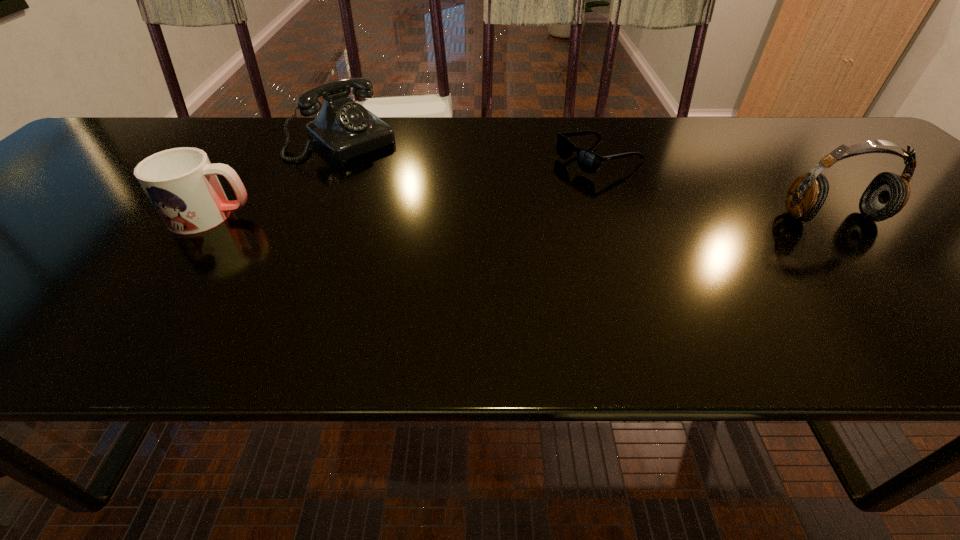
Where is `vacant space that's between the mug and the sunglasses`? Image resolution: width=960 pixels, height=540 pixels. vacant space that's between the mug and the sunglasses is located at coordinates (405, 187).

The image size is (960, 540). In order to click on free area in between the mug and the telephone in this screenshot , I will do `click(277, 178)`.

The height and width of the screenshot is (540, 960). Identify the location of vacant region between the tallest object and the mug. (521, 217).

The image size is (960, 540). Find the location of `vacant point located between the telephone and the sunglasses`. vacant point located between the telephone and the sunglasses is located at coordinates (471, 148).

Find the location of a particular element. The height and width of the screenshot is (540, 960). free space between the rightmost object and the telephone is located at coordinates (588, 178).

The width and height of the screenshot is (960, 540). I want to click on vacant area between the rightmost object and the sunglasses, so click(715, 187).

This screenshot has height=540, width=960. Find the location of `free spot between the mug and the second object from right to left`. free spot between the mug and the second object from right to left is located at coordinates (405, 187).

Find the location of a particular element. The width and height of the screenshot is (960, 540). free area in between the headset and the shortest object is located at coordinates (715, 187).

Where is `free space between the telephone and the mug`? free space between the telephone and the mug is located at coordinates (277, 178).

Identify the location of free space that is in between the shortest object and the headset. (715, 187).